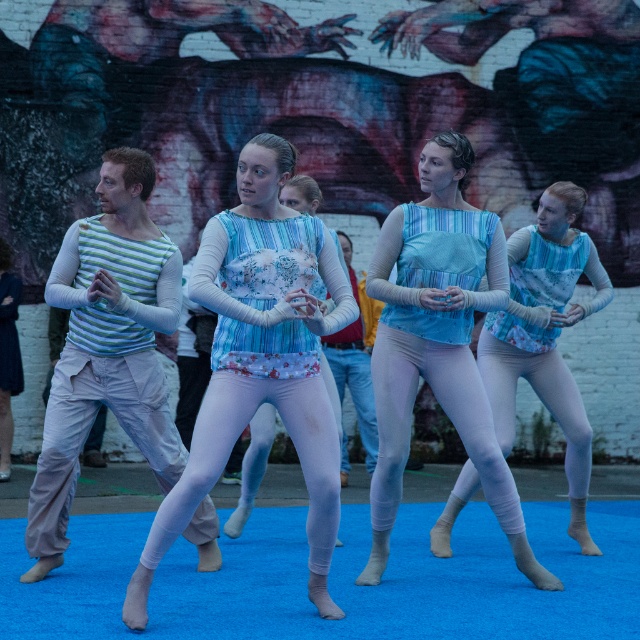
Is blue fabric dress at center closer to camera compared to blue textured tank top at center?

Yes, it is.

Does point (388, 477) come closer to viewer compared to point (502, 342)?

That is True.

What do you see at coordinates (438, 340) in the screenshot? The width and height of the screenshot is (640, 640). I see `blue fabric dress at center` at bounding box center [438, 340].

Locate an element on the screen. blue fabric dress at center is located at coordinates (438, 340).

Between point (337, 488) and point (97, 330), which one is positioned in front?

Point (337, 488)

Does point (285, 243) lie in front of point (134, 204)?

Yes, it is.

Which is behind, point (230, 432) or point (93, 280)?

The point (93, 280) is more distant.

What are the coordinates of `blue floral tank top at center` in the screenshot? It's located at (260, 358).

Who is positioned more to the right, striped jersey at left or blue fabric dress at center?

blue fabric dress at center

Is point (180, 472) closer to viewer compared to point (408, 268)?

No, (180, 472) is further to viewer.

Does point (112, 349) come in front of point (440, 140)?

No, it is behind (440, 140).

Image resolution: width=640 pixels, height=640 pixels. I want to click on striped jersey at left, so click(x=106, y=346).